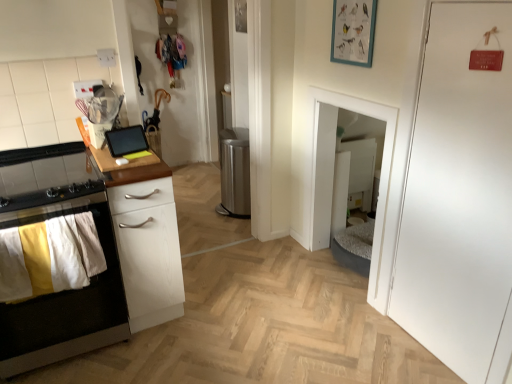
Question: Is the position of white matte door at right less distant than that of white matte cabinet at left?

Choices:
 (A) yes
 (B) no

Answer: (A)

Question: Is white matte door at right taller than white matte cabinet at left?

Choices:
 (A) no
 (B) yes

Answer: (B)

Question: Is white matte door at right turned away from white matte cabinet at left?

Choices:
 (A) no
 (B) yes

Answer: (A)

Question: Does white matte door at right have a smaller size compared to white matte cabinet at left?

Choices:
 (A) yes
 (B) no

Answer: (A)

Question: Is white matte cabinet at left inside white matte door at right?

Choices:
 (A) yes
 (B) no

Answer: (B)

Question: Is white matte door at right aimed at white matte cabinet at left?

Choices:
 (A) no
 (B) yes

Answer: (A)

Question: From a real-world perspective, does white wood chest of drawers at left sit lower than teal matte picture frame at upper center?

Choices:
 (A) yes
 (B) no

Answer: (A)

Question: Is white wood chest of drawers at left surrounding teal matte picture frame at upper center?

Choices:
 (A) no
 (B) yes

Answer: (A)

Question: Is white wood chest of drawers at left positioned far away from teal matte picture frame at upper center?

Choices:
 (A) no
 (B) yes

Answer: (B)

Question: Does white wood chest of drawers at left have a smaller size compared to teal matte picture frame at upper center?

Choices:
 (A) yes
 (B) no

Answer: (B)

Question: Can you confirm if white wood chest of drawers at left is positioned to the left of teal matte picture frame at upper center?

Choices:
 (A) no
 (B) yes

Answer: (B)

Question: Considering the relative sizes of white wood chest of drawers at left and teal matte picture frame at upper center in the image provided, is white wood chest of drawers at left thinner than teal matte picture frame at upper center?

Choices:
 (A) yes
 (B) no

Answer: (B)

Question: Can you confirm if matte black tablet at upper left, the 2th appliance viewed from the right, is positioned to the right of teal matte picture frame at upper center?

Choices:
 (A) yes
 (B) no

Answer: (B)